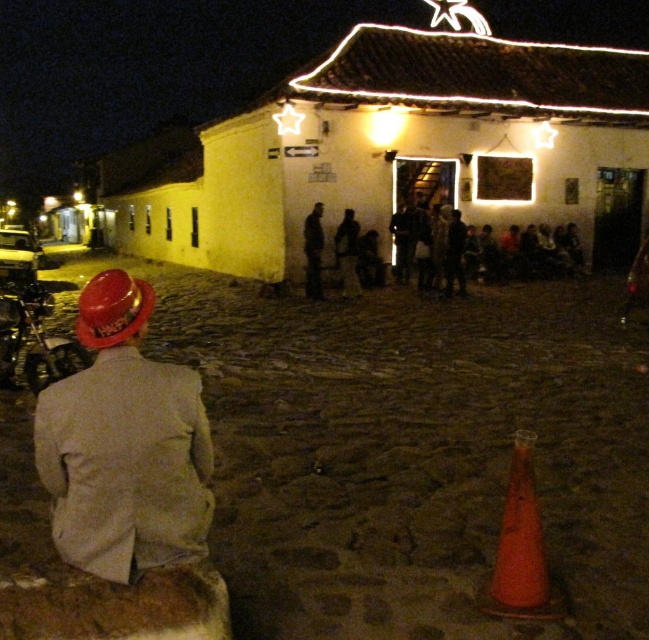
Question: Is matte red hat at lower left positioned behind shiny chrome motorcycle at lower left?

Choices:
 (A) yes
 (B) no

Answer: (B)

Question: Does matte red hat at lower left come behind dark gray fabric at center?

Choices:
 (A) no
 (B) yes

Answer: (A)

Question: Which point appears farthest from the camera in this image?

Choices:
 (A) (19, 332)
 (B) (195, 536)
 (C) (509, 556)

Answer: (A)

Question: Is matte red hat at lower left wider than orange matte traffic cone at lower right?

Choices:
 (A) yes
 (B) no

Answer: (A)

Question: Which point is closer to the camera?

Choices:
 (A) orange matte traffic cone at lower right
 (B) matte red hat at lower left
 (C) shiny chrome motorcycle at lower left
 (D) dark gray fabric at center

Answer: (B)

Question: Which object is positioned farthest from the matte red hat at lower left?

Choices:
 (A) orange matte traffic cone at lower right
 (B) dark gray fabric at center
 (C) shiny chrome motorcycle at lower left

Answer: (B)